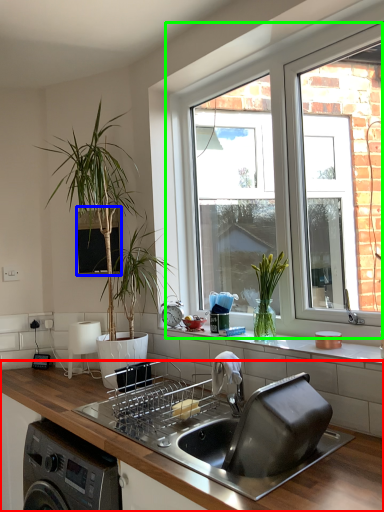
Question: Estimate the real-world distances between objects in this image. Which object is closer to countertop (highlighted by a red box), window screen (highlighted by a blue box) or window (highlighted by a green box)?

Choices:
 (A) window screen
 (B) window

Answer: (A)